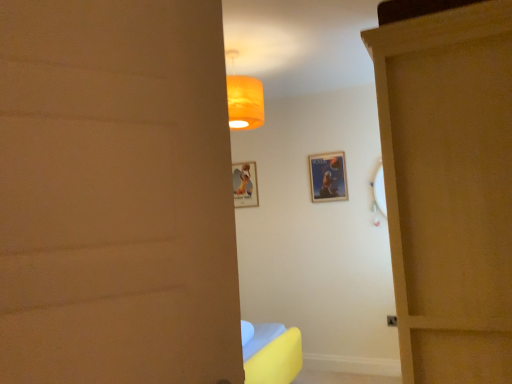
Question: Is metallic silver poster at center, which is counted as the second picture frame, starting from the left, bigger or smaller than wooden door at right?

Choices:
 (A) big
 (B) small

Answer: (B)

Question: From a real-world perspective, is metallic silver poster at center, which is counted as the second picture frame, starting from the left, physically located above or below wooden door at right?

Choices:
 (A) above
 (B) below

Answer: (A)

Question: Estimate the real-world distances between objects in this image. Which object is closer to the matte paper picture frame at center, which is counted as the first picture frame, starting from the left?

Choices:
 (A) wooden door at right
 (B) metallic silver poster at center, which is counted as the second picture frame, starting from the left

Answer: (B)

Question: Which object is positioned farthest from the matte paper picture frame at center, which is counted as the second picture frame, starting from the right?

Choices:
 (A) metallic silver poster at center, which appears as the 2th picture frame when viewed from the back
 (B) wooden door at right

Answer: (B)